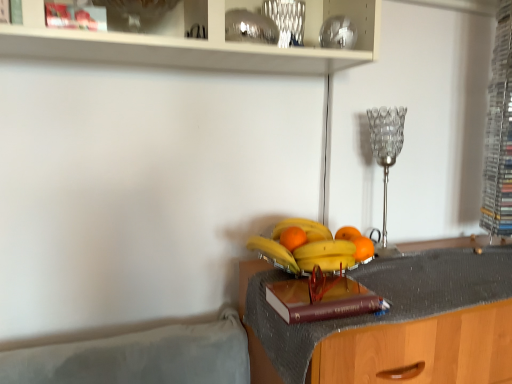
The image size is (512, 384). Describe the element at coordinates (273, 252) in the screenshot. I see `yellow matte bananas at center, the second banana when ordered from top to bottom` at that location.

In order to face yellow matte bananas at center, the first banana when ordered from bottom to top, should I rotate leftwards or rightwards?

To align with it, rotate right about 6.911°.

What do you see at coordinates (287, 20) in the screenshot? The height and width of the screenshot is (384, 512). I see `shiny metallic vase at upper center` at bounding box center [287, 20].

Describe the element at coordinates (386, 156) in the screenshot. I see `clear glass candlestick at center` at that location.

Where is `orange matte at center`? orange matte at center is located at coordinates (356, 242).

At what (x,y) coordinates should I click in order to perform the action: click on citrus fruit lying behind the yellow matte bananas at center, marked as the second banana in a bottom-to-top arrangement. Please return your answer as a coordinate pair (x, y). This screenshot has height=384, width=512. Looking at the image, I should click on (356, 242).

Is yellow matte bananas at center, the second banana when ordered from top to bottom, further to camera compared to orange matte at center?

No, yellow matte bananas at center, the second banana when ordered from top to bottom, is closer to the viewer.

What's the angular difference between yellow matte bananas at center, the second banana when ordered from top to bottom, and orange matte at center's facing directions?

The angular difference between yellow matte bananas at center, the second banana when ordered from top to bottom, and orange matte at center is 64.2 degrees.

Does yellow matte bananas at center, marked as the second banana in a bottom-to-top arrangement, turn towards orange matte at center?

No, yellow matte bananas at center, marked as the second banana in a bottom-to-top arrangement, does not turn towards orange matte at center.

From the image's perspective, between clear glass candlestick at center and orange matte at center, who is located below?

orange matte at center is shown below in the image.

Considering the positions of objects clear glass candlestick at center and orange matte at center in the image provided, who is behind, clear glass candlestick at center or orange matte at center?

clear glass candlestick at center.

Between clear glass candlestick at center and orange matte at center, which one appears on the right side from the viewer's perspective?

Positioned to the right is clear glass candlestick at center.

Is clear glass candlestick at center positioned beyond the bounds of orange matte at center?

Indeed, clear glass candlestick at center is completely outside orange matte at center.

Is shiny metallic vase at upper center oriented towards maroon leather book at center?

No, shiny metallic vase at upper center is not oriented towards maroon leather book at center.

Is shiny metallic vase at upper center not near maroon leather book at center?

No.

Looking at the image, does shiny metallic vase at upper center seem bigger or smaller compared to maroon leather book at center?

Considering their sizes, shiny metallic vase at upper center takes up more space than maroon leather book at center.

Is maroon leather book at center inside shiny metallic vase at upper center?

That's incorrect, maroon leather book at center is not inside shiny metallic vase at upper center.

From the picture: Considering the relative positions of yellow matte banana at center, positioned as the 1th banana in top-to-bottom order, and orange matte at center in the image provided, is yellow matte banana at center, positioned as the 1th banana in top-to-bottom order, behind orange matte at center?

Yes, yellow matte banana at center, positioned as the 1th banana in top-to-bottom order, is behind orange matte at center.

Based on their sizes in the image, would you say yellow matte banana at center, acting as the third banana starting from the bottom, is bigger or smaller than orange matte at center?

In the image, yellow matte banana at center, acting as the third banana starting from the bottom, appears to be larger than orange matte at center.

Is orange matte at center surrounded by yellow matte banana at center, acting as the third banana starting from the bottom?

No, orange matte at center is not inside yellow matte banana at center, acting as the third banana starting from the bottom.

Where is `banana that is the 1st object to the left of the orange matte at center, starting at the anchor`? banana that is the 1st object to the left of the orange matte at center, starting at the anchor is located at coordinates coord(303,229).

Is yellow matte bananas at center, the first banana when ordered from bottom to top, looking in the opposite direction of orange matte at center?

No.

Which is more to the left, yellow matte bananas at center, acting as the 3th banana starting from the top, or orange matte at center?

Positioned to the left is yellow matte bananas at center, acting as the 3th banana starting from the top.

The image size is (512, 384). Identify the location of banana that is the 2nd one when counting leftward from the orange matte at center. (307, 247).

Can you tell me how much yellow matte bananas at center, the first banana when ordered from bottom to top, and orange matte at center differ in facing direction?

Result: The facing directions of yellow matte bananas at center, the first banana when ordered from bottom to top, and orange matte at center are 1.66 degrees apart.

Is yellow matte bananas at center, acting as the 3th banana starting from the top, not near maroon leather book at center?

No, yellow matte bananas at center, acting as the 3th banana starting from the top, is not far from maroon leather book at center.

From a real-world perspective, is yellow matte bananas at center, acting as the 3th banana starting from the top, on top of maroon leather book at center?

Yes, from a real-world perspective, yellow matte bananas at center, acting as the 3th banana starting from the top, is on top of maroon leather book at center.

Considering the sizes of objects yellow matte bananas at center, the first banana when ordered from bottom to top, and maroon leather book at center in the image provided, who is shorter, yellow matte bananas at center, the first banana when ordered from bottom to top, or maroon leather book at center?

maroon leather book at center is shorter.

Can you confirm if clear glass candlestick at center is thinner than orange matte at center?

No.

How many degrees apart are the facing directions of clear glass candlestick at center and orange matte at center?

They differ by 2.02 degrees in their facing directions.

Looking at this image, which point is more distant from viewer, (386, 213) or (371, 246)?

The point (386, 213) is farther.

Considering the positions of objects clear glass candlestick at center and orange matte at center in the image provided, who is more to the right, clear glass candlestick at center or orange matte at center?

clear glass candlestick at center is more to the right.

This screenshot has height=384, width=512. What are the coordinates of `citrus fruit behind the yellow matte bananas at center, the second banana when ordered from top to bottom` in the screenshot? It's located at (356, 242).

This screenshot has width=512, height=384. I want to click on lamp that appears on the right of orange matte at center, so pyautogui.click(x=386, y=156).

Considering their positions, is orange matte at center positioned closer to clear glass candlestick at center than maroon leather book at center?

orange matte at center lies closer to clear glass candlestick at center than the other object.

Based on their spatial positions, is maroon leather book at center or clear glass candlestick at center closer to orange matte at center?

maroon leather book at center lies closer to orange matte at center than the other object.

Looking at the image, which one is located further to clear plastic cds at right, orange matte at center or shiny metallic vase at upper center?

shiny metallic vase at upper center lies further to clear plastic cds at right than the other object.

Based on their spatial positions, is yellow matte bananas at center, the first banana when ordered from bottom to top, or maroon leather book at center further from shiny metallic vase at upper center?

The object further to shiny metallic vase at upper center is maroon leather book at center.

Looking at the image, which one is located further to yellow matte bananas at center, marked as the second banana in a bottom-to-top arrangement, maroon leather book at center or shiny metallic vase at upper center?

shiny metallic vase at upper center.

Estimate the real-world distances between objects in this image. Which object is further from yellow matte bananas at center, the second banana when ordered from top to bottom, orange matte at center or shiny metallic vase at upper center?

shiny metallic vase at upper center is positioned further to the anchor yellow matte bananas at center, the second banana when ordered from top to bottom.

In the scene shown: Which object lies further to the anchor point maroon leather book at center, yellow matte bananas at center, marked as the second banana in a bottom-to-top arrangement, or yellow matte bananas at center, the first banana when ordered from bottom to top?

Among the two, yellow matte bananas at center, marked as the second banana in a bottom-to-top arrangement, is located further to maroon leather book at center.

Considering their positions, is yellow matte bananas at center, marked as the second banana in a bottom-to-top arrangement, positioned closer to clear plastic cds at right than orange matte at center?

Among the two, orange matte at center is located nearer to clear plastic cds at right.

Identify the location of orange between yellow matte bananas at center, marked as the second banana in a bottom-to-top arrangement, and yellow matte bananas at center, acting as the 3th banana starting from the top, in the horizontal direction. (293, 238).

At what (x,y) coordinates should I click in order to perform the action: click on citrus fruit between yellow matte bananas at center, acting as the 3th banana starting from the top, and clear plastic cds at right. Please return your answer as a coordinate pair (x, y). The image size is (512, 384). Looking at the image, I should click on (356, 242).

At what (x,y) coordinates should I click in order to perform the action: click on citrus fruit between shiny metallic vase at upper center and clear plastic cds at right from left to right. Please return your answer as a coordinate pair (x, y). Looking at the image, I should click on (356, 242).

What are the coordinates of `orange between maroon leather book at center and yellow matte banana at center, acting as the third banana starting from the bottom, in the front-back direction` in the screenshot? It's located at (293, 238).